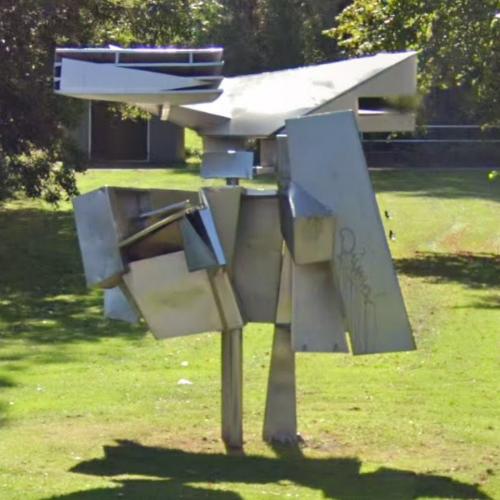
The image size is (500, 500). I want to click on doorway, so click(127, 140).